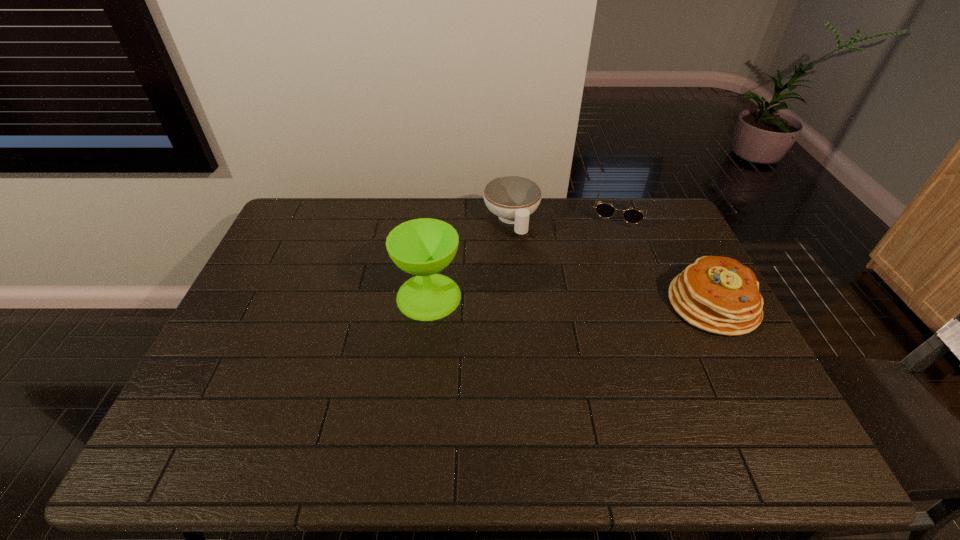
Where is `free region at the near edge`? This screenshot has width=960, height=540. free region at the near edge is located at coordinates (286, 392).

In the image, there is a desktop. At what (x,y) coordinates should I click in order to perform the action: click on vacant space at the right edge. Please return your answer as a coordinate pair (x, y). Looking at the image, I should click on (690, 362).

Where is `vacant space at the far left corner`? vacant space at the far left corner is located at coordinates (295, 214).

I want to click on free space at the near left corner of the desktop, so click(x=209, y=403).

You are a GUI agent. You are given a task and a screenshot of the screen. Output one action in this format:
    pyautogui.click(x=<x>, y=<y>)
    Task: Click on the vacant space at the far right corner of the desktop
    This screenshot has height=540, width=960.
    Given the screenshot: What is the action you would take?
    pyautogui.click(x=664, y=201)

At what (x,y) coordinates should I click in order to perform the action: click on vacant space in between the pancake and the second object from left to right. Please return your answer as a coordinate pair (x, y). Looking at the image, I should click on (612, 262).

At what (x,y) coordinates should I click in order to perform the action: click on free space between the third tallest object and the sunglasses. Please return your answer as a coordinate pair (x, y). Looking at the image, I should click on (565, 217).

The image size is (960, 540). I want to click on free space between the chinaware and the pancake, so click(612, 262).

The width and height of the screenshot is (960, 540). I want to click on empty location between the wineglass and the shortest object, so click(524, 255).

You are a GUI agent. You are given a task and a screenshot of the screen. Output one action in this format:
    pyautogui.click(x=<x>, y=<y>)
    Task: Click on the vacant point located between the leftmost object and the pancake
    The image size is (960, 540).
    Given the screenshot: What is the action you would take?
    pyautogui.click(x=570, y=300)